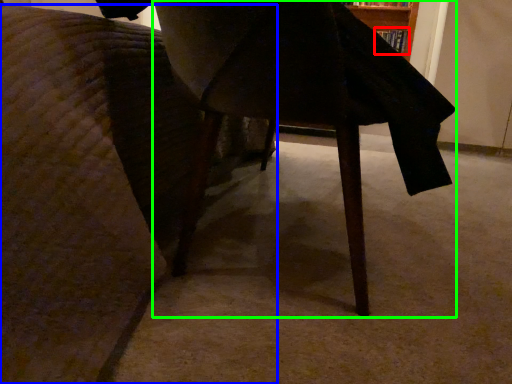
Question: Considering the real-world distances, which object is farthest from book (highlighted by a red box)? furniture (highlighted by a blue box) or table (highlighted by a green box)?

Choices:
 (A) furniture
 (B) table

Answer: (A)